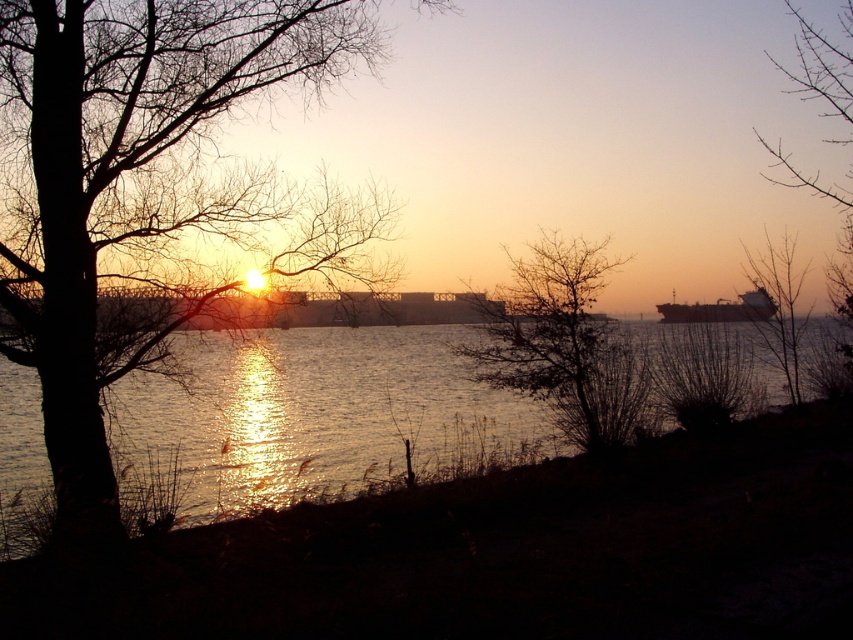
Which is more to the right, glistening water at center or bare branches at right?

bare branches at right is more to the right.

Can you confirm if glistening water at center is bigger than bare branches at right?

Correct, glistening water at center is larger in size than bare branches at right.

The height and width of the screenshot is (640, 853). Identify the location of glistening water at center. (311, 420).

At what (x,y) coordinates should I click in order to perform the action: click on bare branches at center. Please return your answer as a coordinate pair (x, y). Looking at the image, I should click on (563, 344).

Which is more to the left, bare branches at center or metallic ship at right?

bare branches at center

Locate an element on the screen. Image resolution: width=853 pixels, height=640 pixels. bare branches at center is located at coordinates (563, 344).

The height and width of the screenshot is (640, 853). I want to click on bare branches at center, so [563, 344].

Is dark brown bark tree at left closer to the viewer compared to bare branches at center?

Yes, it is in front of bare branches at center.

Is dark brown bark tree at left thinner than bare branches at center?

Yes, dark brown bark tree at left is thinner than bare branches at center.

Is point (80, 173) less distant than point (604, 369)?

Yes, point (80, 173) is in front of point (604, 369).

Image resolution: width=853 pixels, height=640 pixels. I want to click on dark brown bark tree at left, so click(149, 195).